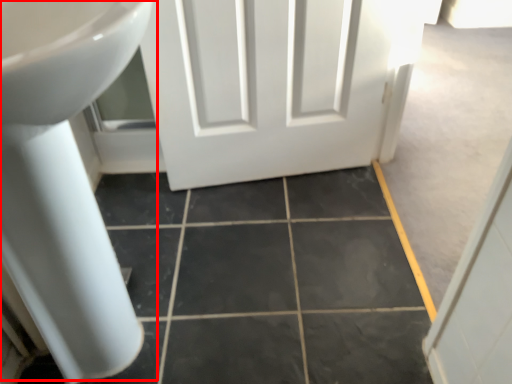
Question: From the image's perspective, considering the relative positions of sink (annotated by the red box) and ceramic tile in the image provided, where is sink (annotated by the red box) located with respect to the staircase?

Choices:
 (A) above
 (B) below

Answer: (A)